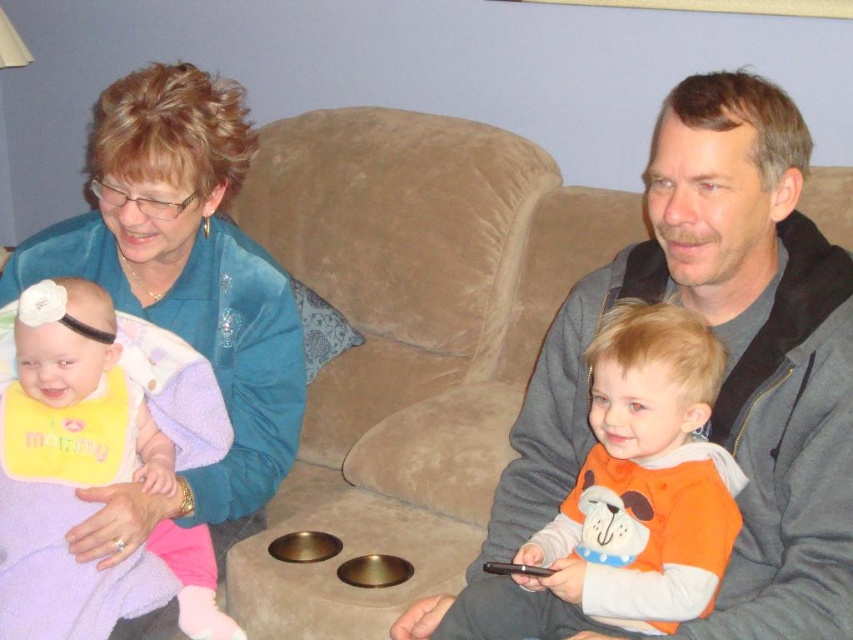
Question: Can you confirm if teal velvet jacket at upper left is thinner than yellow bib at left?

Choices:
 (A) no
 (B) yes

Answer: (A)

Question: Which object is the farthest from the yellow bib at left?

Choices:
 (A) orange soft fabric baby at center
 (B) gray fleece jacket at center

Answer: (A)

Question: Which of these objects is positioned farthest from the orange soft fabric baby at center?

Choices:
 (A) teal velvet jacket at upper left
 (B) yellow bib at left
 (C) gray fleece jacket at center

Answer: (A)

Question: Can you confirm if gray fleece jacket at center is thinner than teal velvet jacket at upper left?

Choices:
 (A) yes
 (B) no

Answer: (B)

Question: Among these points, which one is farthest from the camera?

Choices:
 (A) (123, 316)
 (B) (613, 396)

Answer: (A)

Question: Can you confirm if yellow bib at left is positioned to the right of orange soft fabric baby at center?

Choices:
 (A) yes
 (B) no

Answer: (B)